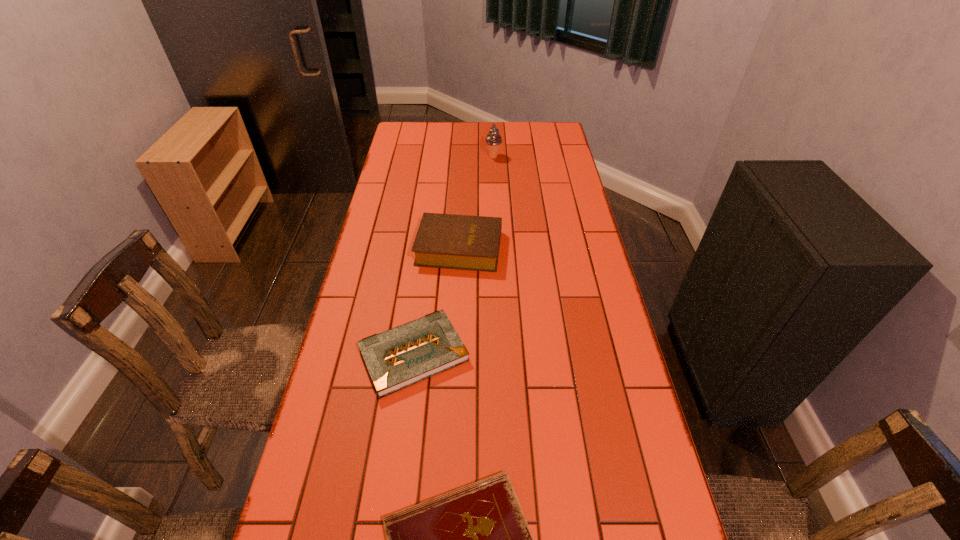
You are a GUI agent. You are given a task and a screenshot of the screen. Output one action in this format:
    pyautogui.click(x=<x>, y=<y>)
    Task: Click on the icecream
    
    Given the screenshot: What is the action you would take?
    pos(493,139)

Find the location of a particular element. The height and width of the screenshot is (540, 960). the tallest object is located at coordinates (493, 139).

Where is `the second tallest object`? the second tallest object is located at coordinates (x=463, y=242).

Locate an element on the screen. The image size is (960, 540). Bible is located at coordinates pyautogui.click(x=463, y=242).

This screenshot has height=540, width=960. Identify the location of the farther notebook. (402, 356).

You are a GUI agent. You are given a task and a screenshot of the screen. Output one action in this format:
    pyautogui.click(x=<x>, y=<y>)
    Task: Click on the third farthest object
    This screenshot has width=960, height=540.
    Given the screenshot: What is the action you would take?
    pyautogui.click(x=402, y=356)

In order to click on vacant space situated 0.330m on the left of the tallest object in this screenshot , I will do `click(409, 157)`.

The width and height of the screenshot is (960, 540). Identify the location of free location located on the back of the third nearest object. (462, 203).

At what (x,y) coordinates should I click in order to perform the action: click on vacant region located on the front of the taller notebook. Please return your answer as a coordinate pair (x, y). Looking at the image, I should click on (405, 418).

At what (x,y) coordinates should I click in order to perform the action: click on object present at the left edge. Please return your answer as a coordinate pair (x, y). The height and width of the screenshot is (540, 960). Looking at the image, I should click on (402, 356).